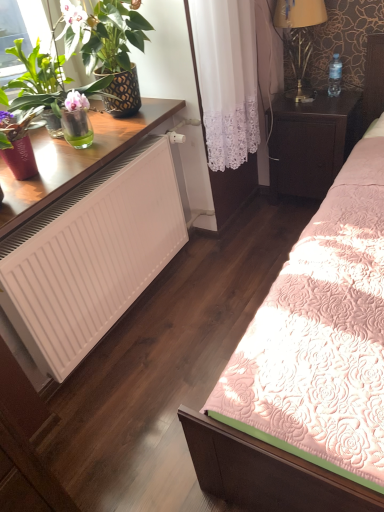
Question: Considering the relative positions of pink floral quilt at center and matte black pot at left in the image provided, is pink floral quilt at center behind matte black pot at left?

Choices:
 (A) no
 (B) yes

Answer: (A)

Question: Is pink floral quilt at center beside matte black pot at left?

Choices:
 (A) yes
 (B) no

Answer: (B)

Question: Considering the relative positions of pink floral quilt at center and matte black pot at left in the image provided, is pink floral quilt at center to the right of matte black pot at left from the viewer's perspective?

Choices:
 (A) yes
 (B) no

Answer: (A)

Question: From a real-world perspective, is pink floral quilt at center located beneath matte black pot at left?

Choices:
 (A) yes
 (B) no

Answer: (A)

Question: Is the depth of pink floral quilt at center less than that of matte black pot at left?

Choices:
 (A) no
 (B) yes

Answer: (B)

Question: Based on their positions, is white lace curtain at center located to the left or right of gold metallic lamp at upper right?

Choices:
 (A) left
 (B) right

Answer: (A)

Question: Is white lace curtain at center bigger or smaller than gold metallic lamp at upper right?

Choices:
 (A) big
 (B) small

Answer: (A)

Question: From the image's perspective, is white lace curtain at center positioned above or below gold metallic lamp at upper right?

Choices:
 (A) below
 (B) above

Answer: (A)

Question: From their relative heights in the image, would you say white lace curtain at center is taller or shorter than gold metallic lamp at upper right?

Choices:
 (A) tall
 (B) short

Answer: (A)

Question: From a real-world perspective, is matte black pot at left above or below wooden desk at left?

Choices:
 (A) above
 (B) below

Answer: (A)

Question: Would you say matte black pot at left is to the left or to the right of wooden desk at left in the picture?

Choices:
 (A) right
 (B) left

Answer: (A)

Question: In the image, is matte black pot at left positioned in front of or behind wooden desk at left?

Choices:
 (A) behind
 (B) front

Answer: (B)

Question: Is matte black pot at left wider or thinner than wooden desk at left?

Choices:
 (A) thin
 (B) wide

Answer: (A)

Question: From the image's perspective, is white matte radiator at lower left above or below gold metallic lamp at upper right?

Choices:
 (A) above
 (B) below

Answer: (B)

Question: Considering their positions, is white matte radiator at lower left located in front of or behind gold metallic lamp at upper right?

Choices:
 (A) behind
 (B) front

Answer: (B)